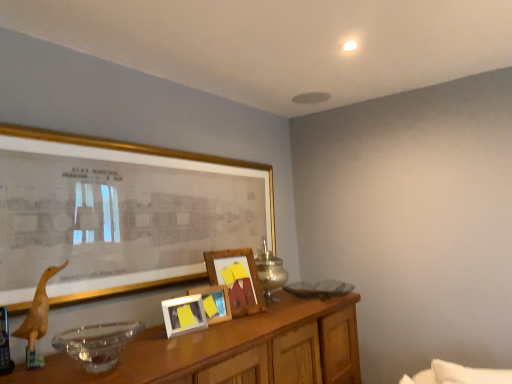
This screenshot has height=384, width=512. What are the coordinates of `free spot in front of matte wooden picture frame at center, which is counted as the 3th picture frame, starting from the back` in the screenshot? It's located at (188, 333).